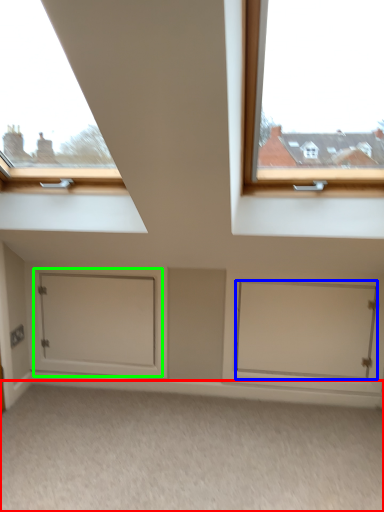
Question: Which is farther away from plain (highlighted by a red box)? door (highlighted by a blue box) or door (highlighted by a green box)?

Choices:
 (A) door
 (B) door

Answer: (B)